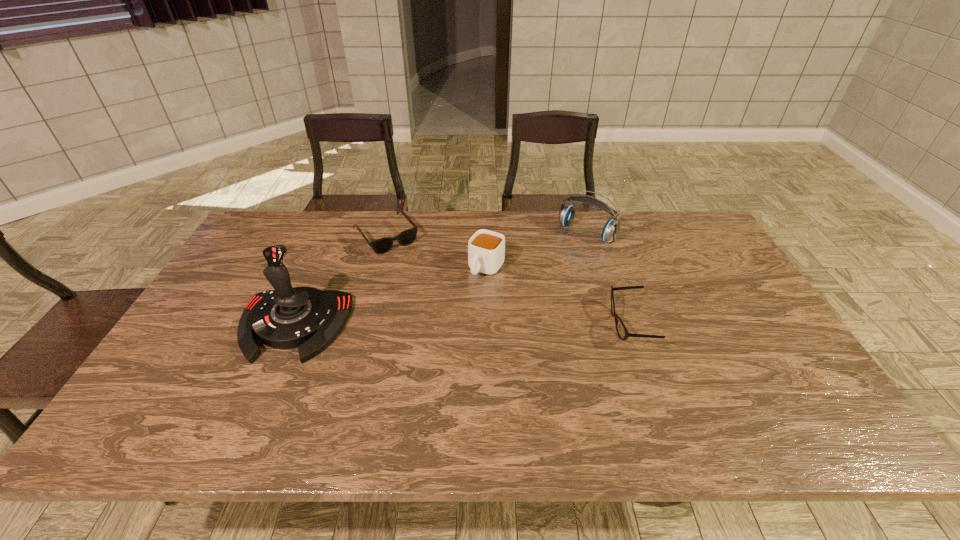
Image resolution: width=960 pixels, height=540 pixels. I want to click on vacant region between the spectacles and the tallest object, so click(x=462, y=325).

Where is `vacant area between the cup and the headset`? The width and height of the screenshot is (960, 540). vacant area between the cup and the headset is located at coordinates (537, 251).

Where is `free space between the spectacles and the sunglasses`? free space between the spectacles and the sunglasses is located at coordinates (508, 280).

This screenshot has width=960, height=540. Identify the location of free spot between the third object from right to left and the second tallest object. (537, 251).

Locate an element on the screen. This screenshot has width=960, height=540. free space between the spectacles and the third tallest object is located at coordinates (558, 296).

Identify the location of vacant area that lies between the joystick and the second tallest object. The width and height of the screenshot is (960, 540). (440, 279).

Image resolution: width=960 pixels, height=540 pixels. Identify the location of the fourth closest object to the spectacles. (308, 318).

Where is `object that is the second nearest to the spectacles`? This screenshot has height=540, width=960. object that is the second nearest to the spectacles is located at coordinates (486, 249).

Find the location of a particular element. vacant region that satisfies the following two spatial constraints: 1. on the front side of the third shortest object; 2. on the front-facing side of the spectacles is located at coordinates (488, 325).

At what (x,y) coordinates should I click in order to perform the action: click on free space that satisfies the following two spatial constraints: 1. on the front side of the sunglasses; 2. on the front-facing side of the spectacles. Please return your answer as a coordinate pair (x, y). This screenshot has width=960, height=540. Looking at the image, I should click on (362, 325).